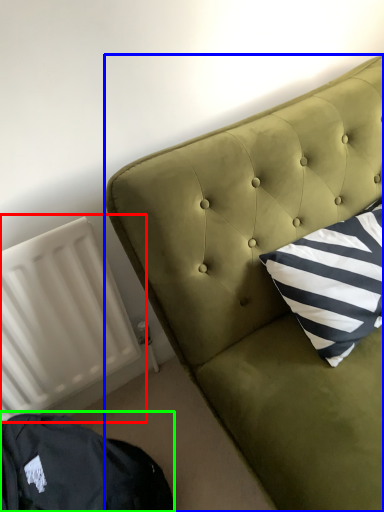
Question: Which object is the farthest from radiator (highlighted by a red box)? Choose among these: furniture (highlighted by a blue box) or bean bag chair (highlighted by a green box).

Choices:
 (A) furniture
 (B) bean bag chair

Answer: (A)